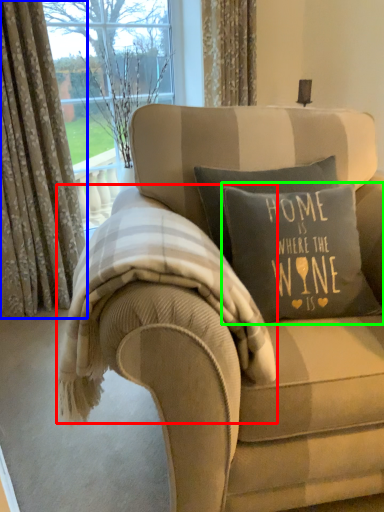
Question: Considering the real-world distances, which object is farthest from bedding (highlighted by a red box)? curtain (highlighted by a blue box) or pillow (highlighted by a green box)?

Choices:
 (A) curtain
 (B) pillow

Answer: (A)